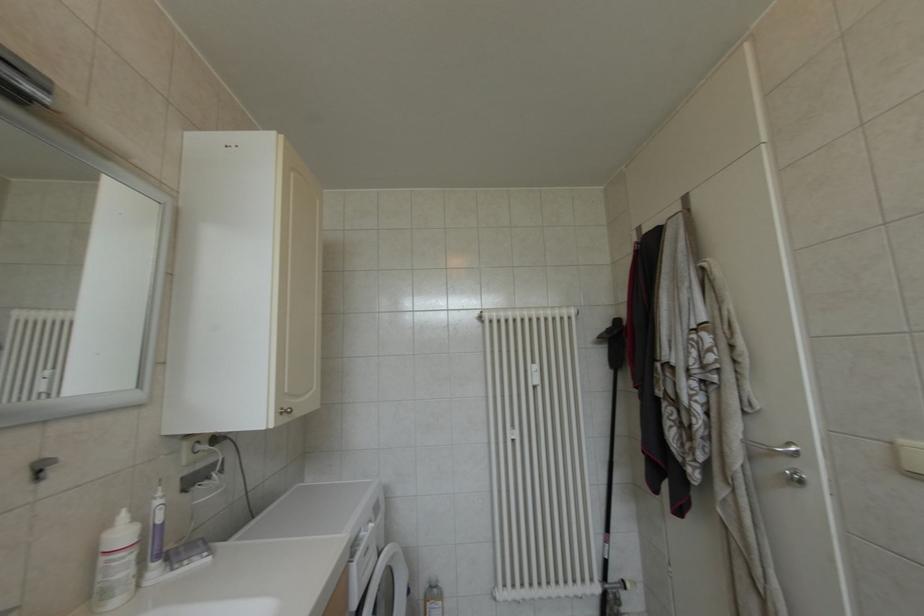
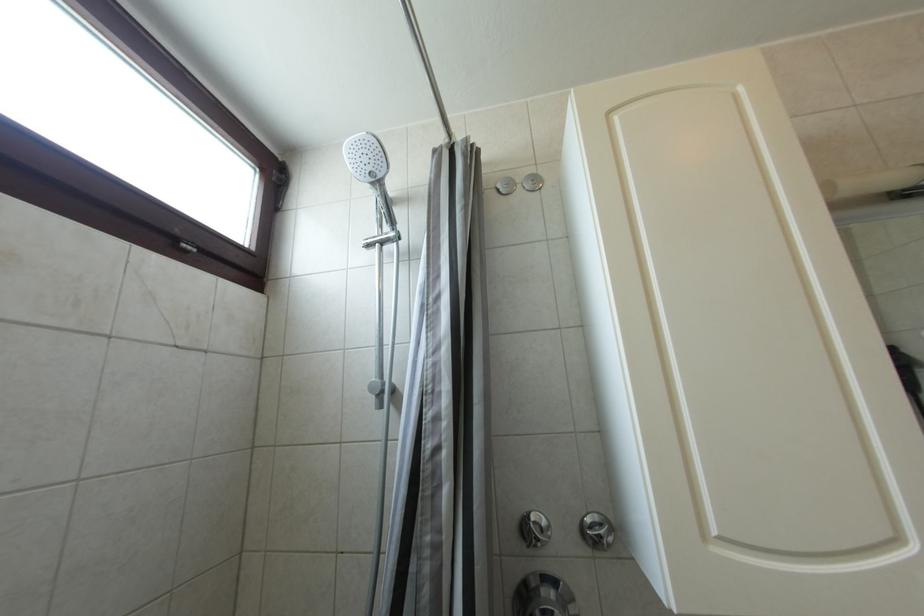
How did the camera likely rotate?

The camera's rotation is toward left-up.